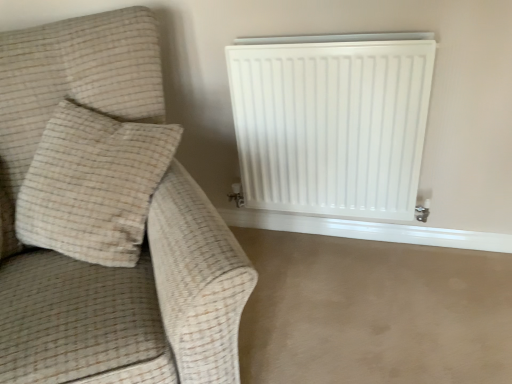
You are a GUI agent. You are given a task and a screenshot of the screen. Output one action in this format:
    pyautogui.click(x=<x>, y=<y>)
    Task: Click on the beige fabric couch at left
    
    Given the screenshot: What is the action you would take?
    pyautogui.click(x=106, y=218)

I want to click on beige textured pillow at left, so click(93, 185).

Which is behind, beige fabric couch at left or beige carpet at lower right?

beige carpet at lower right is further from the camera.

Could you tell me if beige fabric couch at left is facing beige carpet at lower right?

No, beige fabric couch at left is not aimed at beige carpet at lower right.

From a real-world perspective, does beige fabric couch at left sit lower than beige carpet at lower right?

No, from a real-world perspective, beige fabric couch at left is not beneath beige carpet at lower right.

Which of these two, beige fabric couch at left or beige carpet at lower right, is bigger?

Bigger between the two is beige fabric couch at left.

Considering the positions of objects white matte radiator at upper right and beige textured pillow at left in the image provided, who is behind, white matte radiator at upper right or beige textured pillow at left?

white matte radiator at upper right is behind.

Is white matte radiator at upper right oriented towards beige textured pillow at left?

No.

Does white matte radiator at upper right have a greater width compared to beige textured pillow at left?

No, white matte radiator at upper right is not wider than beige textured pillow at left.

From a real-world perspective, which is physically above, white matte radiator at upper right or beige textured pillow at left?

beige textured pillow at left, from a real-world perspective.

Looking at the image, does beige carpet at lower right seem bigger or smaller compared to beige textured pillow at left?

Clearly, beige carpet at lower right is larger in size than beige textured pillow at left.

Are beige carpet at lower right and beige textured pillow at left located far from each other?

beige carpet at lower right is actually quite close to beige textured pillow at left.

Is beige textured pillow at left a part of beige carpet at lower right?

Actually, beige textured pillow at left is outside beige carpet at lower right.

Could you tell me if beige carpet at lower right is facing beige textured pillow at left?

No, beige carpet at lower right is not facing towards beige textured pillow at left.

From a real-world perspective, is beige textured pillow at left physically located above or below white matte radiator at upper right?

beige textured pillow at left is above white matte radiator at upper right.

What's the angular difference between beige textured pillow at left and white matte radiator at upper right's facing directions?

There is a 7.53-degree angle between the facing directions of beige textured pillow at left and white matte radiator at upper right.

Is beige textured pillow at left beside white matte radiator at upper right?

No, beige textured pillow at left is not next to white matte radiator at upper right.

From the image's perspective, which is below, beige carpet at lower right or white matte radiator at upper right?

beige carpet at lower right.

From the picture: Which object is further away from the camera taking this photo, beige carpet at lower right or white matte radiator at upper right?

white matte radiator at upper right is more distant.

Is beige carpet at lower right surrounding white matte radiator at upper right?

No, white matte radiator at upper right is located outside of beige carpet at lower right.

Is white matte radiator at upper right completely or partially outside of beige fabric couch at left?

Absolutely, white matte radiator at upper right is external to beige fabric couch at left.

From the image's perspective, is white matte radiator at upper right located above beige fabric couch at left?

Yes, from the image's perspective, white matte radiator at upper right is on top of beige fabric couch at left.

Is white matte radiator at upper right positioned with its back to beige fabric couch at left?

No, beige fabric couch at left is not at the back of white matte radiator at upper right.

I want to click on furniture lying in front of the white matte radiator at upper right, so (x=106, y=218).

Could you tell me if beige fabric couch at left is facing beige textured pillow at left?

Yes, beige fabric couch at left faces towards beige textured pillow at left.

Who is bigger, beige fabric couch at left or beige textured pillow at left?

beige fabric couch at left.

Image resolution: width=512 pixels, height=384 pixels. I want to click on pillow on the right of the beige fabric couch at left, so click(93, 185).

Are beige fabric couch at left and beige textured pillow at left located far from each other?

No, there isn't a large distance between beige fabric couch at left and beige textured pillow at left.

You are a GUI agent. You are given a task and a screenshot of the screen. Output one action in this format:
    pyautogui.click(x=<x>, y=<y>)
    Task: Click on the furniture that is on the left side of beige carpet at lower right
    
    Given the screenshot: What is the action you would take?
    pyautogui.click(x=106, y=218)

I want to click on radiator that is on the right side of beige textured pillow at left, so click(332, 121).

Looking at the image, which one is located further to beige textured pillow at left, beige carpet at lower right or beige fabric couch at left?

The object further to beige textured pillow at left is beige carpet at lower right.

When comparing their distances from beige textured pillow at left, does beige carpet at lower right or white matte radiator at upper right seem further?

beige carpet at lower right is further to beige textured pillow at left.

Based on their spatial positions, is beige fabric couch at left or beige textured pillow at left closer to beige carpet at lower right?

beige fabric couch at left.

Considering their positions, is beige textured pillow at left positioned further to beige carpet at lower right than beige fabric couch at left?

beige textured pillow at left.

Which object lies nearer to the anchor point beige fabric couch at left, beige textured pillow at left or beige carpet at lower right?

Among the two, beige textured pillow at left is located nearer to beige fabric couch at left.

When comparing their distances from beige carpet at lower right, does beige textured pillow at left or white matte radiator at upper right seem further?

beige textured pillow at left is positioned further to the anchor beige carpet at lower right.

When comparing their distances from beige fabric couch at left, does white matte radiator at upper right or beige carpet at lower right seem closer?

Based on the image, white matte radiator at upper right appears to be nearer to beige fabric couch at left.

Which object lies further to the anchor point beige fabric couch at left, beige textured pillow at left or white matte radiator at upper right?

Among the two, white matte radiator at upper right is located further to beige fabric couch at left.

Find the location of `radiator between beige textured pillow at left and beige carpet at lower right in the horizontal direction`. radiator between beige textured pillow at left and beige carpet at lower right in the horizontal direction is located at coordinates click(332, 121).

Image resolution: width=512 pixels, height=384 pixels. I want to click on radiator located between beige fabric couch at left and beige carpet at lower right in the left-right direction, so click(332, 121).

I want to click on pillow between beige fabric couch at left and white matte radiator at upper right from left to right, so click(93, 185).

This screenshot has width=512, height=384. I want to click on pillow between beige fabric couch at left and beige carpet at lower right from left to right, so click(x=93, y=185).